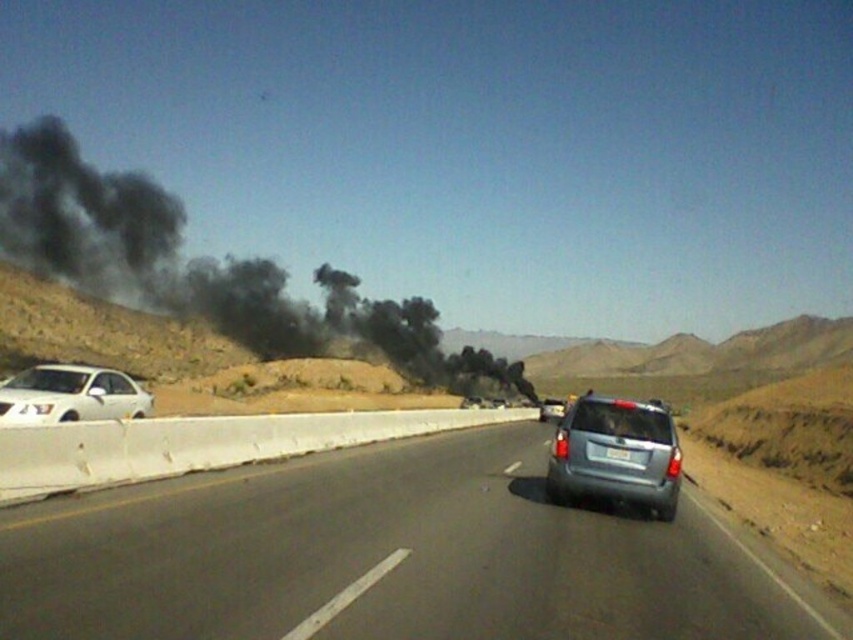
You are a driver in a car behind the satin silver suv at center. You need to read the white plastic license plate at rear to get the license number. Can you read it clearly from your current position?

The satin silver suv at center and white plastic license plate at rear are 18.51 inches apart from each other. Since the distance between them is only 18.51 inches, you can likely read the license plate clearly from your current position if you have a clear line of sight and good visibility.

You are a driver on the highway and notice a point marked at coordinates (202, 266). Based on the scene description, what does this point represent?

The point at coordinates (202, 266) indicates black smoke at left, which is likely from a fire or combustion source off the highway.